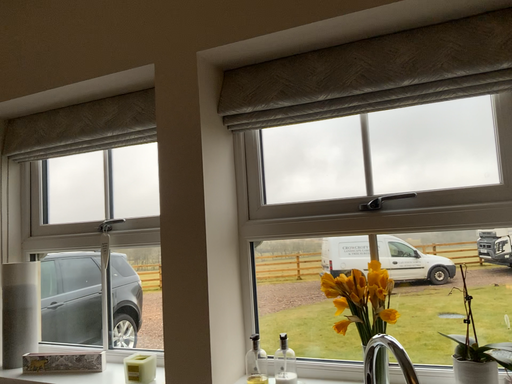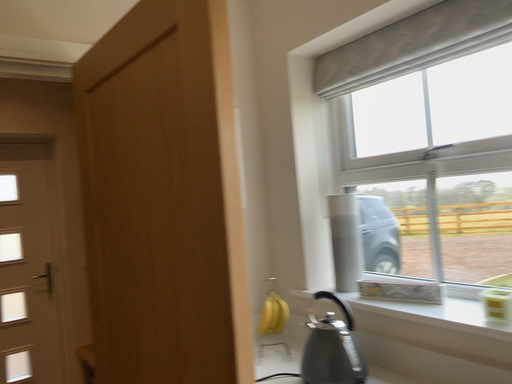
Question: Which way did the camera rotate in the video?

Choices:
 (A) rotated downward
 (B) rotated upward

Answer: (A)